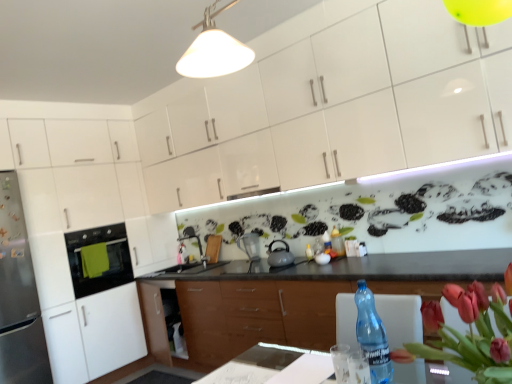
Question: From the image's perspective, is clear glass water at table center located above or below transparent plastic bottle at lower right?

Choices:
 (A) above
 (B) below

Answer: (B)

Question: From a real-world perspective, is clear glass water at table center physically located above or below transparent plastic bottle at lower right?

Choices:
 (A) below
 (B) above

Answer: (A)

Question: Which of these objects is positioned farthest from the matte gray tea pot at center?

Choices:
 (A) vivid red petals at right
 (B) wooden cabinet at center, which is counted as the 3th cabinetry, starting from the top
 (C) white glossy cabinet at left, marked as the 2th cabinetry in a top-to-bottom arrangement
 (D) black matte sink at center
 (E) white glossy cabinets at upper center, placed as the first cabinetry when sorted from top to bottom

Answer: (A)

Question: Considering the real-world distances, which object is closest to the satin silver refrigerator at left?

Choices:
 (A) wooden cabinet at center, which is counted as the 3th cabinetry, starting from the top
 (B) clear glass water at table center
 (C) black matte sink at center
 (D) white glossy cabinet at left, the 2th cabinetry when ordered from bottom to top
 (E) matte silver pitcher at center

Answer: (D)